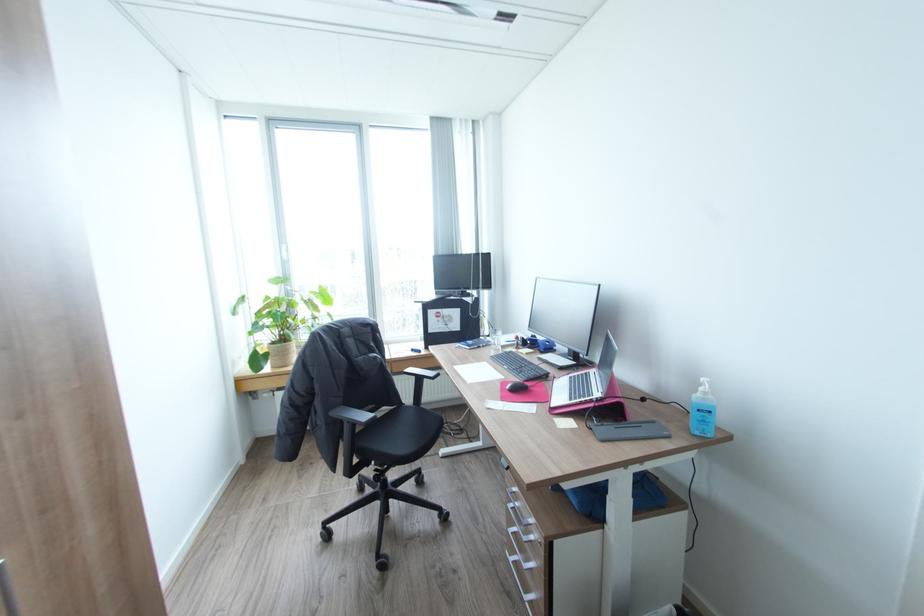
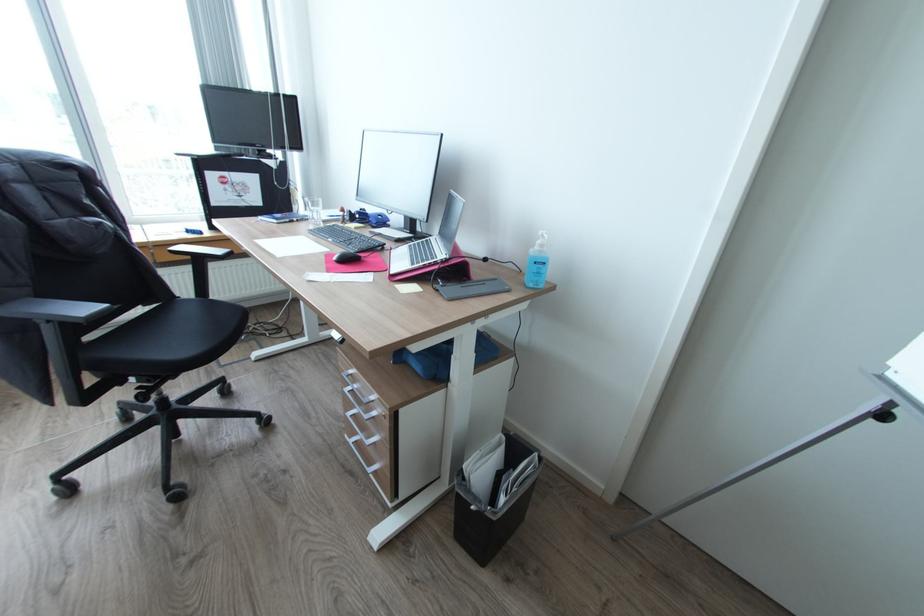
Find the pixel in the second image that matches pixel 533 342 in the first image.

(362, 216)